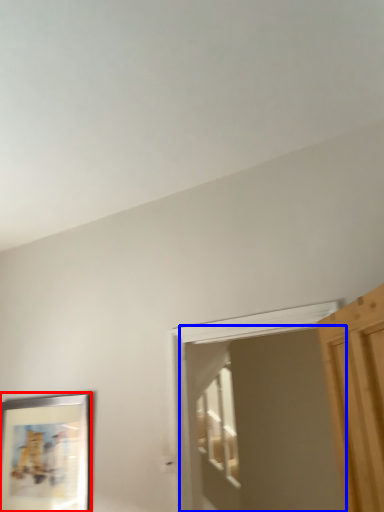
Question: Which of the following is the farthest to the observer, picture frame (highlighted by a red box) or screen door (highlighted by a blue box)?

Choices:
 (A) picture frame
 (B) screen door

Answer: (A)